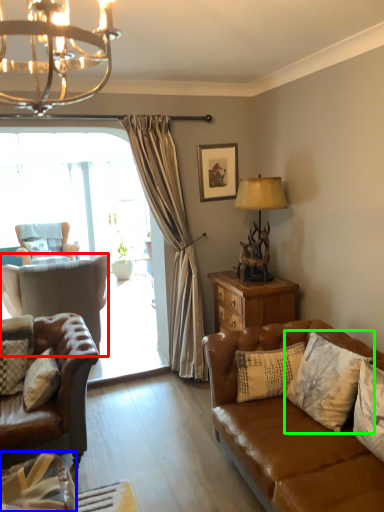
Question: Which object is positioned closest to chair (highlighted by a red box)? Select from pillow (highlighted by a blue box) and pillow (highlighted by a green box).

Choices:
 (A) pillow
 (B) pillow

Answer: (A)